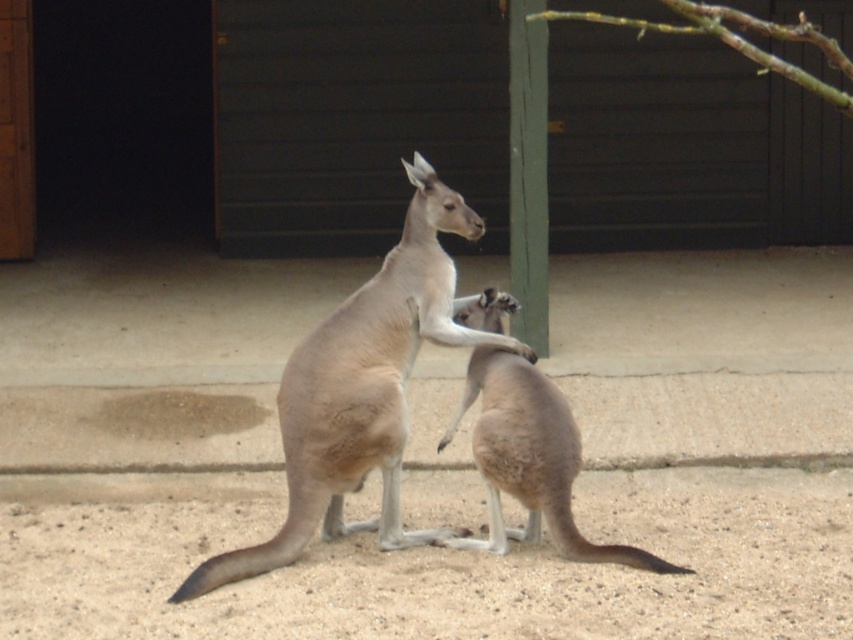
You are a zookeeper observing the kangaroos in their enclosure. You notice the light brown fur at center and the green wood pole at center. Which object is closer to the ground?

→ The light brown fur at center is positioned under the green wood pole at center, so it is closer to the ground.

You are a zookeeper standing at the entrance of the kangaroo enclosure. You need to throw a small treat to the light brown fur kangaroo at center. Considering your throwing range is 7 meters, will you be able to reach it?

The light brown fur kangaroo at center is 7.34 meters away from the viewer, which exceeds your throwing range of 7 meters. Therefore, you cannot reach it with a throw.